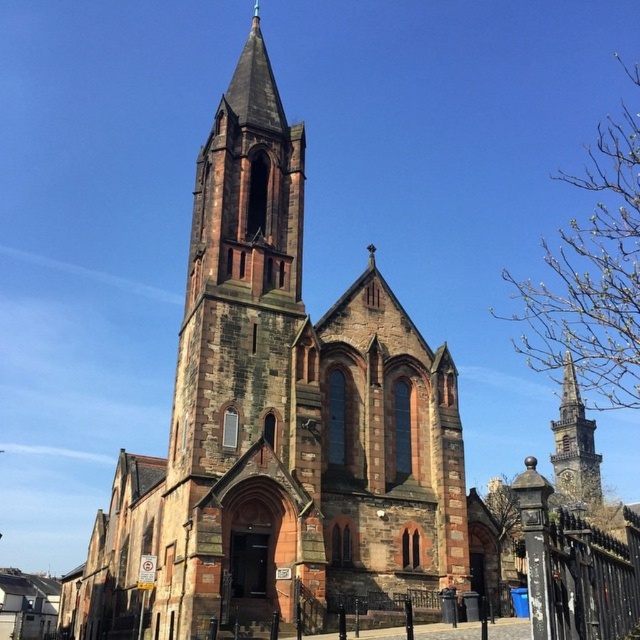
Between point (362, 472) and point (557, 428), which one is positioned in front?

Point (362, 472)

Does brown stone church at center have a greater width compared to stone spire at right?

Yes, brown stone church at center is wider than stone spire at right.

This screenshot has height=640, width=640. Identify the location of brown stone church at center. (276, 422).